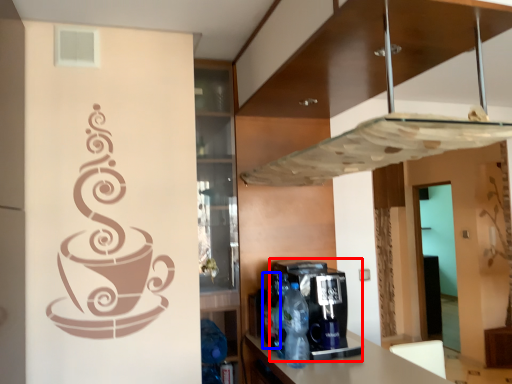
Question: Which object appears farthest to the camera in this image, coffee machine (highlighted by a red box) or bottle (highlighted by a blue box)?

Choices:
 (A) coffee machine
 (B) bottle

Answer: (B)